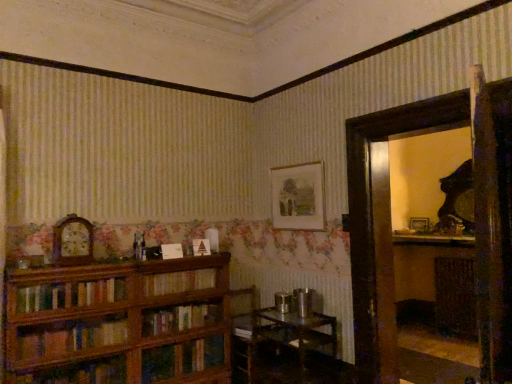
Question: Is wooden bookcase at left bigger or smaller than wooden clock at left?

Choices:
 (A) small
 (B) big

Answer: (B)

Question: Is wooden bookcase at left in front of or behind wooden clock at left in the image?

Choices:
 (A) behind
 (B) front

Answer: (B)

Question: Which object is the closest to the wooden bookshelf at center?

Choices:
 (A) matte white mantel at upper right
 (B) wooden picture frame at right, the second picture frame when ordered from front to back
 (C) wooden shelf at right
 (D) metallic silver table at lower center
 (E) matte paper picture frame at upper center, the first picture frame from the left

Answer: (D)

Question: Estimate the real-world distances between objects in this image. Which object is closer to the matte paper picture frame at upper center, which is counted as the first picture frame, starting from the front?

Choices:
 (A) wooden picture frame at right, the 1th picture frame in the back-to-front sequence
 (B) wooden bookcase at left
 (C) wooden clock at left
 (D) metallic silver table at lower center
 (E) wooden shelf at right

Answer: (D)